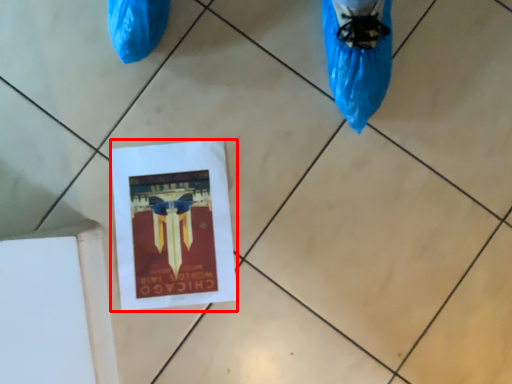
Question: From the image's perspective, considering the relative positions of flyer (annotated by the red box) and tile in the image provided, where is flyer (annotated by the red box) located with respect to the staircase?

Choices:
 (A) below
 (B) above

Answer: (B)